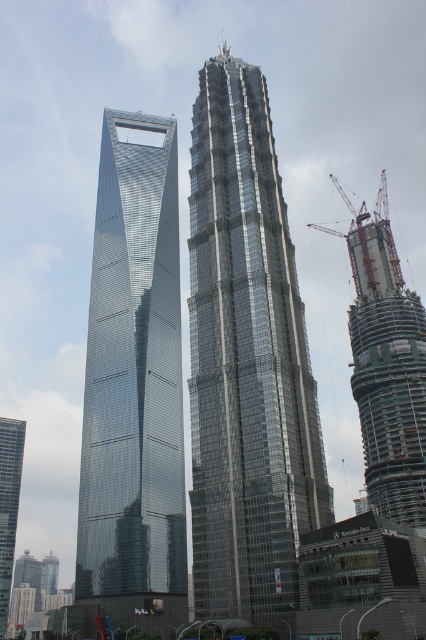
Question: Which object is positioned closest to the glassy metallic skyscraper at left?

Choices:
 (A) concrete construction at right
 (B) shiny glass skyscraper at left
 (C) metallic construction crane at right

Answer: (B)

Question: Which of the following is the farthest from the observer?

Choices:
 (A) (391, 266)
 (B) (385, 465)
 (C) (106, 221)
 (D) (14, 428)

Answer: (D)

Question: Is shiny glass skyscraper at center thinner than metallic construction crane at right?

Choices:
 (A) yes
 (B) no

Answer: (A)

Question: Can you confirm if shiny glass skyscraper at center is positioned to the right of glassy metallic skyscraper at left?

Choices:
 (A) no
 (B) yes

Answer: (B)

Question: Does shiny glass skyscraper at left have a smaller size compared to metallic construction crane at right?

Choices:
 (A) yes
 (B) no

Answer: (A)

Question: Estimate the real-world distances between objects in this image. Which object is farther from the glassy metallic skyscraper at left?

Choices:
 (A) concrete construction at right
 (B) metallic construction crane at right

Answer: (B)